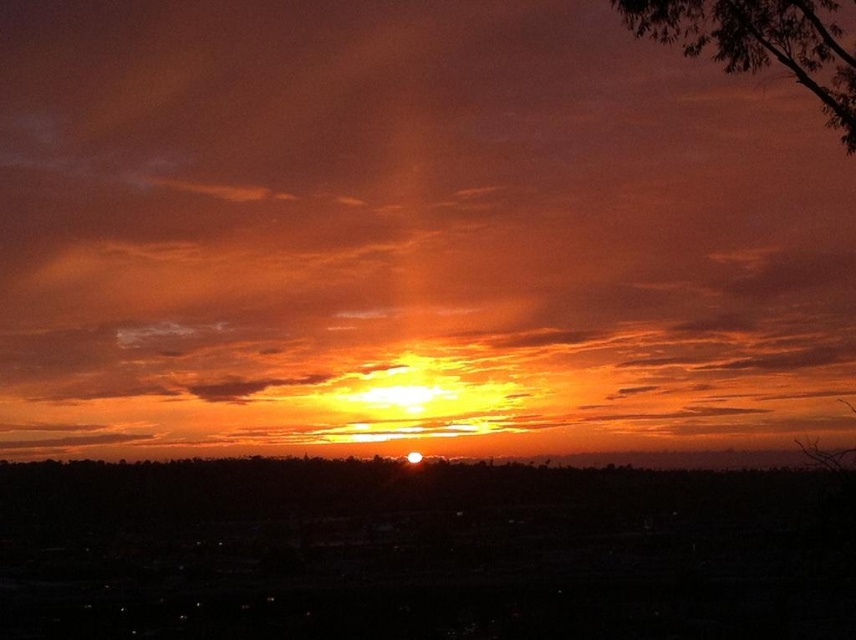
You are an astronomer observing the sunset scene. You notice the orange matte cloud at center and the dark green leafy tree at upper right. Based on their positions, which object is closer to the horizon?

The orange matte cloud at center is closer to the horizon because it is positioned below the dark green leafy tree at upper right, which places it lower in the visual plane.

You are an astronomer analyzing the sunset image. You notice a point at coordinates (x=407, y=234). What object in the scene is this point located on?

The point at coordinates (x=407, y=234) is located on the orange matte cloud at center.